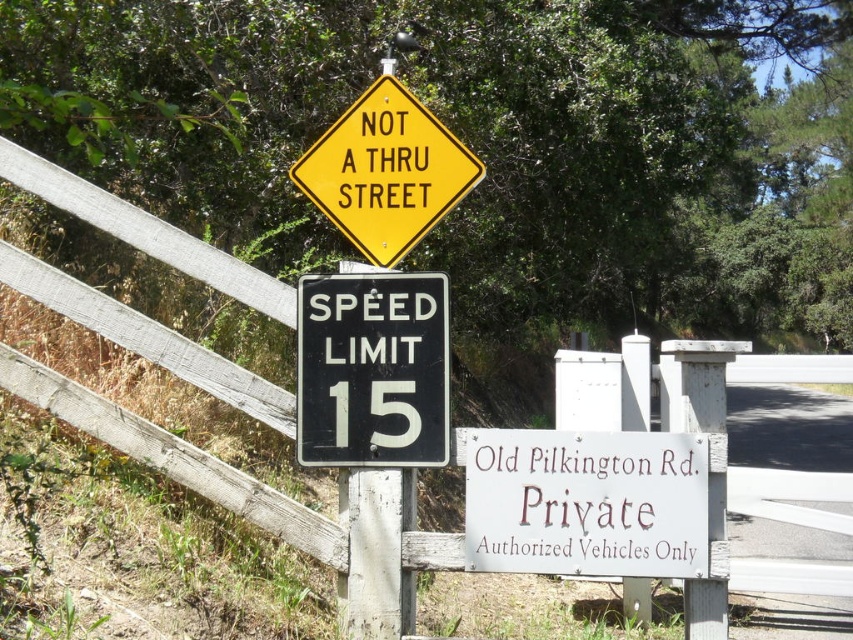
Question: Where is black glossy speed limit sign at center located in relation to yellow diamond-shaped sign at upper center in the image?

Choices:
 (A) right
 (B) left

Answer: (B)

Question: From the image, what is the correct spatial relationship of white painted wood sign at lower center in relation to black glossy speed limit sign at center?

Choices:
 (A) above
 (B) below

Answer: (B)

Question: Which of these objects is positioned closest to the yellow diamond-shaped sign at upper center?

Choices:
 (A) white painted wood sign at lower center
 (B) black glossy speed limit sign at center

Answer: (B)

Question: Can you confirm if white painted wood sign at lower center is positioned above black glossy speed limit sign at center?

Choices:
 (A) no
 (B) yes

Answer: (A)

Question: Estimate the real-world distances between objects in this image. Which object is closer to the black glossy speed limit sign at center?

Choices:
 (A) white painted wood sign at lower center
 (B) yellow diamond-shaped sign at upper center

Answer: (B)

Question: Among these objects, which one is farthest from the camera?

Choices:
 (A) yellow diamond-shaped sign at upper center
 (B) white painted wood sign at lower center

Answer: (A)